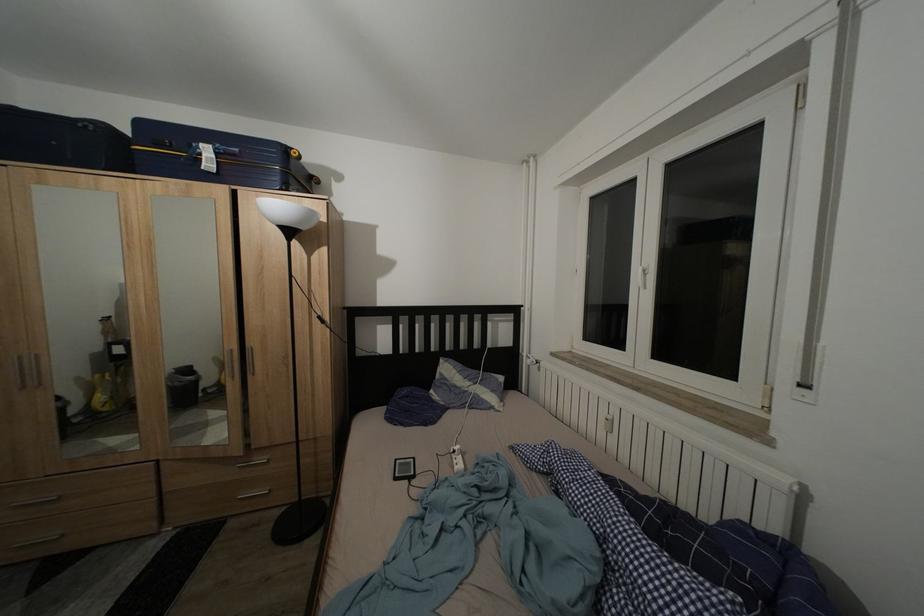
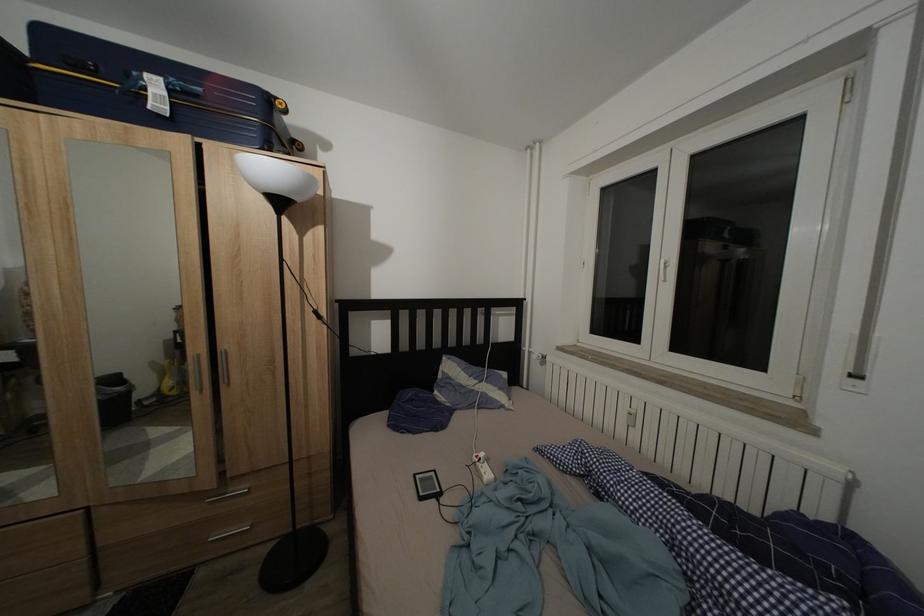
Where in the second image is the point corresponding to point (404, 467) from the first image?

(422, 482)